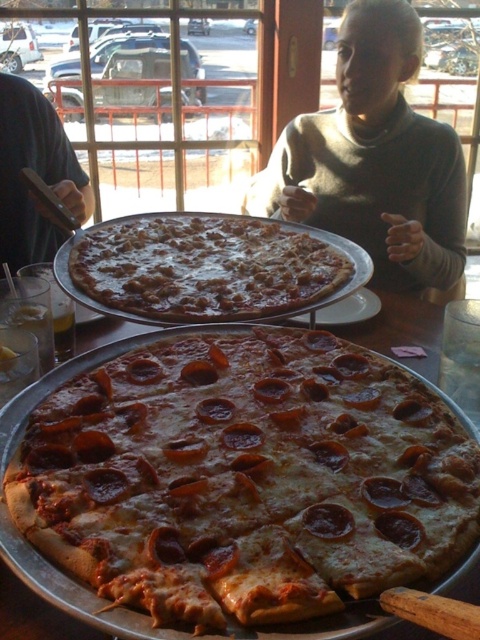
You are a delivery person who needs to pick up the cheesy pepperoni pizza at center from the dining table. The table has a coordinate system where the bottom left corner is the origin. The coordinates given are in normalized units between 0 and 1. To reach the pizza, you must move in a straight line from the edge of the table. What direction should you move from the edge of the table to reach the pizza?

The cheesy pepperoni pizza at center is located at coordinates approximately 0.684 on the x axis and 0.048 on the y axis. Since the coordinate system has the origin at the bottom left corner, moving towards the right and slightly upwards from the edge closest to the bottom left would reach the pizza.

You are a customer in a pizzeria and you want to take a photo of the two pizzas. You notice two points of interest marked as point 1 at coordinate [182,476] and point 2 at coordinate [157,234]. Which point should you focus on to capture both pizzas clearly in your photo?

Point 1 at coordinate [182,476] is closer to the viewer than point 2 at coordinate [157,234], so focusing on point 1 will help capture both pizzas clearly.

You are a delivery person who needs to place both the cheesy pepperoni pizza at center and the slightly browned cheese pizza at center into a box that is 12 inches wide. Can both pizzas fit side by side in the box?

The distance between the cheesy pepperoni pizza at center and the slightly browned cheese pizza at center is 10.06 inches. Since the box is 12 inches wide, which is wider than the combined space they occupy, both pizzas can fit side by side in the box.